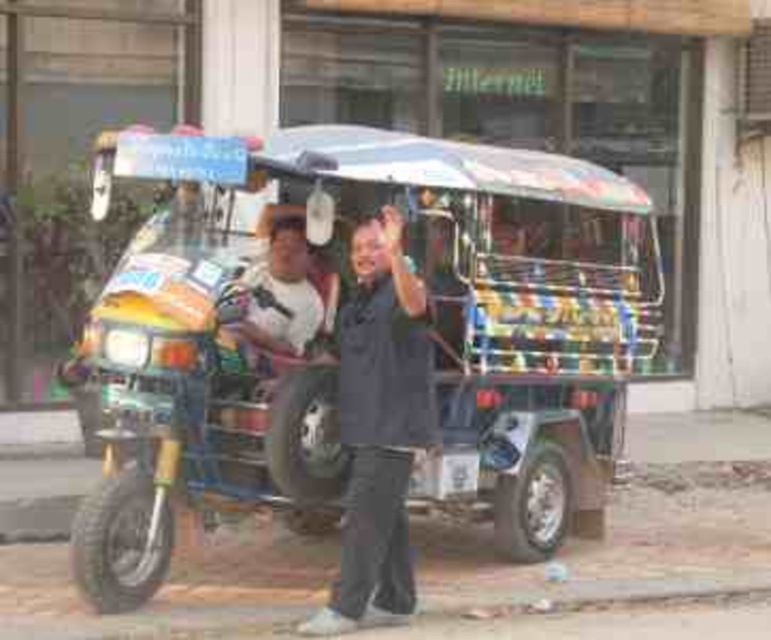
Question: Does multicolored painted cart at center come behind dark gray fabric shirt at center?

Choices:
 (A) yes
 (B) no

Answer: (A)

Question: Does multicolored painted cart at center appear over dark gray fabric shirt at center?

Choices:
 (A) yes
 (B) no

Answer: (A)

Question: Which object appears closest to the camera in this image?

Choices:
 (A) dark gray fabric shirt at center
 (B) multicolored painted cart at center

Answer: (A)

Question: Among these objects, which one is farthest from the camera?

Choices:
 (A) multicolored painted cart at center
 (B) dark gray fabric shirt at center

Answer: (A)

Question: Observing the image, what is the correct spatial positioning of multicolored painted cart at center in reference to dark gray fabric shirt at center?

Choices:
 (A) right
 (B) left

Answer: (A)

Question: Which point appears closest to the camera in this image?

Choices:
 (A) (371, 435)
 (B) (495, 211)

Answer: (A)